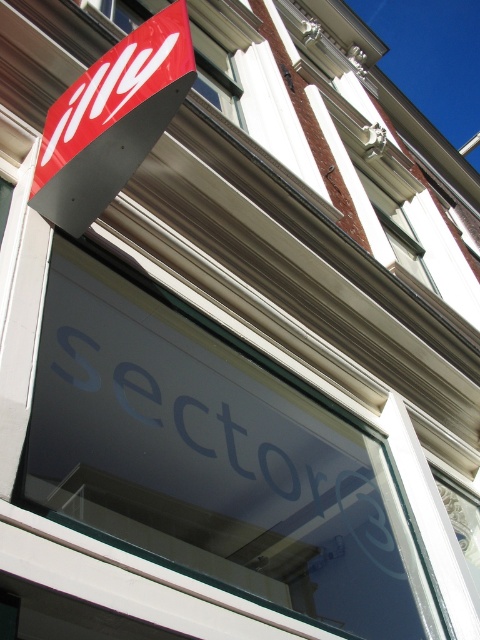
You are a window installer assessing the building exterior. The matte red sign at upper left and the red matte sign at upper left need to be replaced. Which sign should you prioritize replacing if the one with the greater height is more urgent?

The matte red sign at upper left should be prioritized because it has a greater height compared to the red matte sign at upper left, making it more urgent to replace.

You are standing in front of the building and notice two points marked on the facade. The first point is at coordinates point (x=122, y=68) and the second is at point (x=323, y=202). From your perspective, which point appears closer to you?

Point (x=122, y=68) is in front of point (x=323, y=202), so it appears closer to you.

You are standing in front of the building and want to read both the matte red sign at upper left and the Sector 3 text on the window below it. If you can only move your eyes 7 feet horizontally, can you read both without moving your head?

The matte red sign at upper left and the Sector 3 text on the window below it are 7.37 feet apart, which is slightly more than the 7 feet your eyes can move. Therefore, you cannot read both without moving your head.